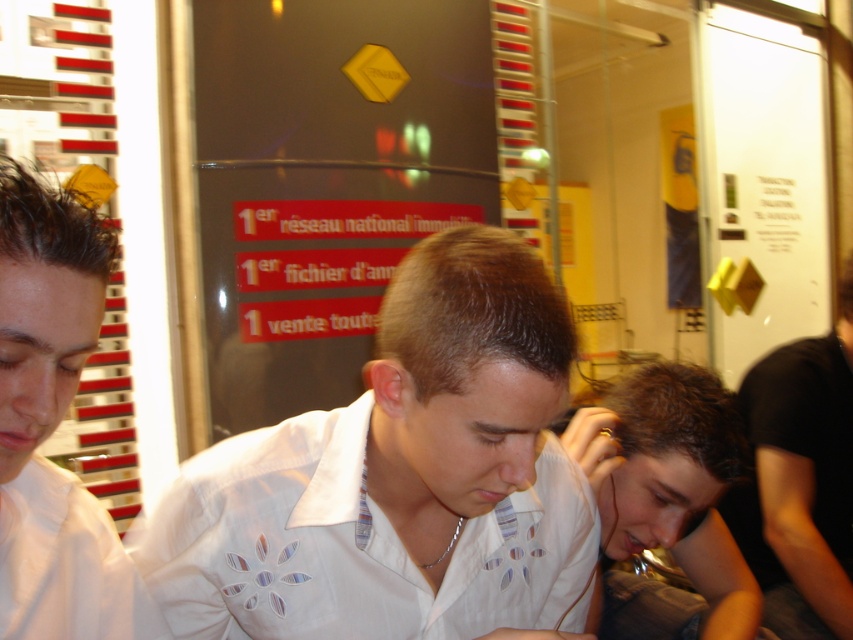
Looking at this image, you are a delivery person who needs to hand over a package to the person wearing the white matte shirt at left. You are standing 20 inches away from them. Can you reach them without moving closer?

The distance between you and the person wearing the white matte shirt at left is 19.44 inches, so yes, you can reach them without moving closer since you are only 0.56 inches farther away than the required distance.